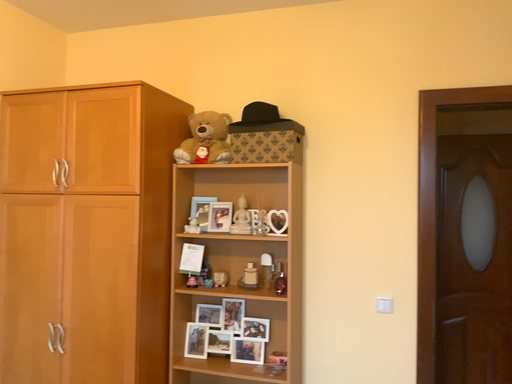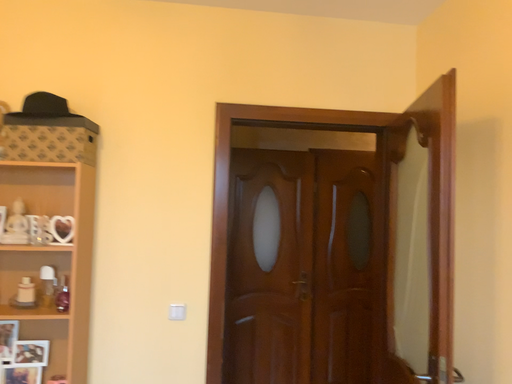
Question: Which way did the camera rotate in the video?

Choices:
 (A) rotated right
 (B) rotated left

Answer: (A)